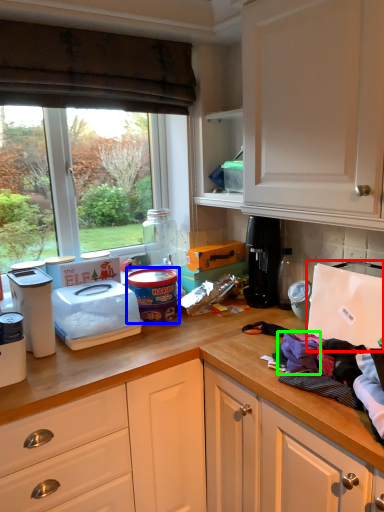
Question: Based on their relative distances, which object is nearer to appliance (highlighted by a red box)? Choose from appliance (highlighted by a blue box) and clothing (highlighted by a green box).

Choices:
 (A) appliance
 (B) clothing

Answer: (B)